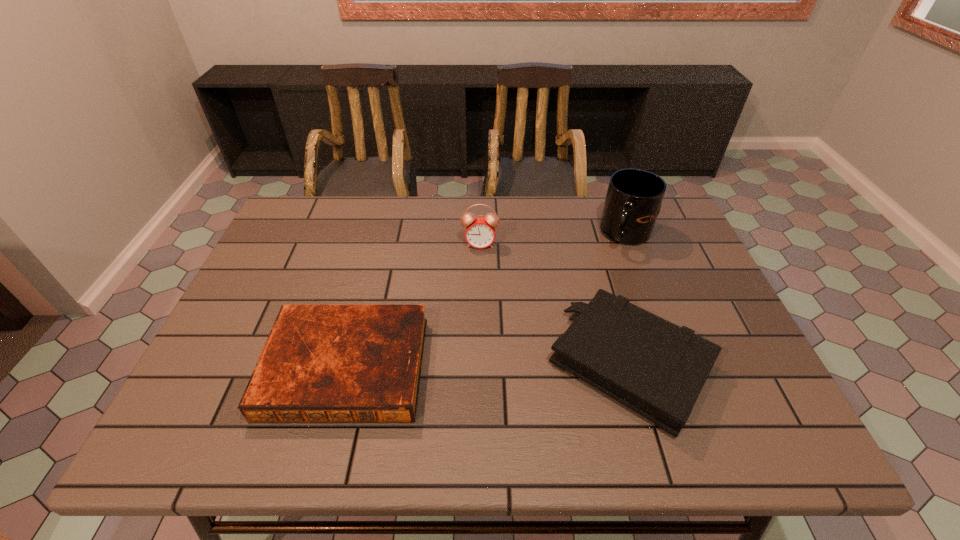
Locate an element on the screen. The width and height of the screenshot is (960, 540). free area in between the shortest object and the right Bible is located at coordinates (489, 366).

In order to click on free spot between the alarm clock and the taller Bible in this screenshot , I will do `click(555, 305)`.

Locate an element on the screen. empty space that is in between the third shortest object and the mug is located at coordinates (553, 239).

The height and width of the screenshot is (540, 960). Find the location of `unoccupied position between the third shortest object and the mug`. unoccupied position between the third shortest object and the mug is located at coordinates (553, 239).

This screenshot has width=960, height=540. I want to click on free space that is in between the left Bible and the right Bible, so click(x=489, y=366).

Identify which object is the closest to the taller Bible. Please provide its 2D coordinates. Your answer should be formatted as a tuple, i.e. [(x, y)], where the tuple contains the x and y coordinates of a point satisfying the conditions above.

[(633, 201)]

Where is `object that can be found as the second closest to the leftmost object`? object that can be found as the second closest to the leftmost object is located at coordinates (657, 369).

Find the location of `free location that satisfies the following two spatial constraints: 1. on the back side of the mug; 2. on the right side of the alarm clock`. free location that satisfies the following two spatial constraints: 1. on the back side of the mug; 2. on the right side of the alarm clock is located at coordinates [x=480, y=234].